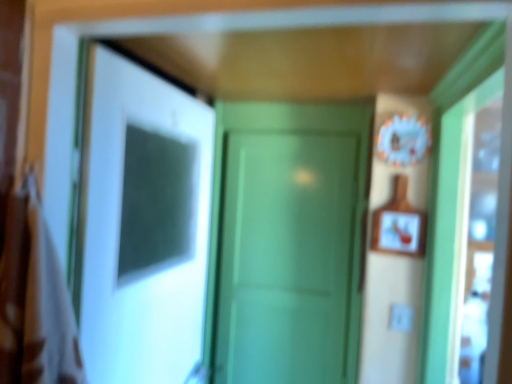
The width and height of the screenshot is (512, 384). What do you see at coordinates (398, 232) in the screenshot?
I see `wooden framed picture at right` at bounding box center [398, 232].

Image resolution: width=512 pixels, height=384 pixels. Describe the element at coordinates (34, 300) in the screenshot. I see `brown fabric laundry at left` at that location.

Find the location of a particular element. Image resolution: width=512 pixels, height=384 pixels. wooden framed picture at right is located at coordinates (398, 232).

Is point (229, 376) more distant than point (384, 221)?

Yes, it is.

Is green matte door at center, which appears as the second door when viewed from the left, directly adjacent to wooden framed picture at right?

No, green matte door at center, which appears as the second door when viewed from the left, is not making contact with wooden framed picture at right.

Do you think green matte door at center, which is counted as the first door, starting from the back, is within wooden framed picture at right, or outside of it?

green matte door at center, which is counted as the first door, starting from the back, is not inside wooden framed picture at right, it's outside.

From the image's perspective, which one is positioned lower, green matte door at center, which appears as the second door when viewed from the left, or wooden framed picture at right?

green matte door at center, which appears as the second door when viewed from the left.

Is point (170, 114) closer or farther from the camera than point (79, 354)?

Point (170, 114) appears to be farther away from the viewer than point (79, 354).

From a real-world perspective, is white glossy door at center, which ranks as the 2th door in back-to-front order, physically below brown fabric laundry at left?

No, from a real-world perspective, white glossy door at center, which ranks as the 2th door in back-to-front order, is not below brown fabric laundry at left.

The width and height of the screenshot is (512, 384). Identify the location of door that appears above the brown fabric laundry at left (from a real-world perspective). (144, 225).

Is white glossy door at center, which ranks as the 2th door in back-to-front order, facing away from brown fabric laundry at left?

white glossy door at center, which ranks as the 2th door in back-to-front order, is not turned away from brown fabric laundry at left.

Considering the sizes of brown fabric laundry at left and green matte door at center, arranged as the 1th door when viewed from the right, in the image, is brown fabric laundry at left taller or shorter than green matte door at center, arranged as the 1th door when viewed from the right,?

Clearly, brown fabric laundry at left is shorter compared to green matte door at center, arranged as the 1th door when viewed from the right.

Based on the photo, from the image's perspective, who appears lower, brown fabric laundry at left or green matte door at center, which is counted as the first door, starting from the back?

From the image's view, green matte door at center, which is counted as the first door, starting from the back, is below.

Is brown fabric laundry at left bigger than green matte door at center, acting as the second door starting from the front?

Actually, brown fabric laundry at left might be smaller than green matte door at center, acting as the second door starting from the front.

Is there a large distance between green matte door at center, acting as the second door starting from the front, and brown fabric laundry at left?

Indeed, green matte door at center, acting as the second door starting from the front, is not near brown fabric laundry at left.

Consider the image. Would you say green matte door at center, arranged as the 1th door when viewed from the right, is inside or outside brown fabric laundry at left?

The correct answer is: outside.

Does point (350, 263) come behind point (61, 316)?

Yes.

Is green matte door at center, arranged as the 1th door when viewed from the right, oriented towards brown fabric laundry at left?

Yes.

From a real-world perspective, which object rests below the other?

green matte door at center, which is counted as the first door, starting from the back, is physically lower.

In the image, is wooden framed picture at right on the left side or the right side of green matte door at center, arranged as the 1th door when viewed from the right?

Based on their positions, wooden framed picture at right is located to the right of green matte door at center, arranged as the 1th door when viewed from the right.

Measure the distance between wooden framed picture at right and green matte door at center, arranged as the 1th door when viewed from the right.

wooden framed picture at right is 17.00 inches away from green matte door at center, arranged as the 1th door when viewed from the right.

At what (x,y) coordinates should I click in order to perform the action: click on picture frame above the green matte door at center, which appears as the second door when viewed from the left (from a real-world perspective). Please return your answer as a coordinate pair (x, y). The width and height of the screenshot is (512, 384). Looking at the image, I should click on (398, 232).

Is white glossy door at center, the 1th door from the left, taller than green matte door at center, which appears as the second door when viewed from the left?

In fact, white glossy door at center, the 1th door from the left, may be shorter than green matte door at center, which appears as the second door when viewed from the left.

Based on the photo, is white glossy door at center, which ranks as the second door in right-to-left order, oriented away from green matte door at center, arranged as the 1th door when viewed from the right?

No, white glossy door at center, which ranks as the second door in right-to-left order, is not facing the opposite direction of green matte door at center, arranged as the 1th door when viewed from the right.

From a real-world perspective, who is located higher, white glossy door at center, which ranks as the 2th door in back-to-front order, or green matte door at center, which is counted as the first door, starting from the back?

white glossy door at center, which ranks as the 2th door in back-to-front order, is physically above.

Considering the sizes of objects white glossy door at center, which ranks as the 1th door in front-to-back order, and green matte door at center, which is counted as the first door, starting from the back, in the image provided, who is bigger, white glossy door at center, which ranks as the 1th door in front-to-back order, or green matte door at center, which is counted as the first door, starting from the back,?

With larger size is white glossy door at center, which ranks as the 1th door in front-to-back order.

In the image, is brown fabric laundry at left positioned in front of or behind wooden framed picture at right?

Clearly, brown fabric laundry at left is in front of wooden framed picture at right.

Can wooden framed picture at right be found inside brown fabric laundry at left?

Actually, wooden framed picture at right is outside brown fabric laundry at left.

Identify the location of picture frame above the brown fabric laundry at left (from a real-world perspective). The width and height of the screenshot is (512, 384). (398, 232).

From the picture: Which of these two, brown fabric laundry at left or wooden framed picture at right, is wider?

brown fabric laundry at left is wider.

Starting from the wooden framed picture at right, which door is the 1st one to the left? Please provide its 2D coordinates.

[(288, 241)]

Locate an element on the screen. This screenshot has width=512, height=384. laundry that appears below the white glossy door at center, the 1th door from the left (from a real-world perspective) is located at coordinates (34, 300).

Estimate the real-world distances between objects in this image. Which object is further from wooden framed picture at right, white glossy door at center, which ranks as the 1th door in front-to-back order, or green matte door at center, which appears as the second door when viewed from the left?

The object further to wooden framed picture at right is white glossy door at center, which ranks as the 1th door in front-to-back order.

Considering their positions, is green matte door at center, acting as the second door starting from the front, positioned further to white glossy door at center, which ranks as the second door in right-to-left order, than brown fabric laundry at left?

green matte door at center, acting as the second door starting from the front, is positioned further to the anchor white glossy door at center, which ranks as the second door in right-to-left order.

From the image, which object appears to be farther from brown fabric laundry at left, white glossy door at center, which ranks as the 1th door in front-to-back order, or wooden framed picture at right?

wooden framed picture at right is positioned further to the anchor brown fabric laundry at left.

Estimate the real-world distances between objects in this image. Which object is further from wooden framed picture at right, brown fabric laundry at left or white glossy door at center, the 1th door from the left?

brown fabric laundry at left is positioned further to the anchor wooden framed picture at right.

When comparing their distances from wooden framed picture at right, does brown fabric laundry at left or green matte door at center, acting as the second door starting from the front, seem further?

Based on the image, brown fabric laundry at left appears to be further to wooden framed picture at right.

Estimate the real-world distances between objects in this image. Which object is closer to white glossy door at center, the 1th door from the left, wooden framed picture at right or green matte door at center, which is counted as the first door, starting from the back?

green matte door at center, which is counted as the first door, starting from the back, is closer to white glossy door at center, the 1th door from the left.

Looking at the image, which one is located closer to green matte door at center, which is counted as the first door, starting from the back, white glossy door at center, which ranks as the second door in right-to-left order, or wooden framed picture at right?

wooden framed picture at right is closer to green matte door at center, which is counted as the first door, starting from the back.

When comparing their distances from green matte door at center, which is counted as the first door, starting from the back, does brown fabric laundry at left or wooden framed picture at right seem further?

Among the two, brown fabric laundry at left is located further to green matte door at center, which is counted as the first door, starting from the back.

Where is `door located between brown fabric laundry at left and green matte door at center, which is counted as the first door, starting from the back, in the depth direction`? This screenshot has height=384, width=512. door located between brown fabric laundry at left and green matte door at center, which is counted as the first door, starting from the back, in the depth direction is located at coordinates (x=144, y=225).

Locate an element on the screen. The width and height of the screenshot is (512, 384). picture frame between brown fabric laundry at left and green matte door at center, which appears as the second door when viewed from the left, in the front-back direction is located at coordinates (398, 232).

Image resolution: width=512 pixels, height=384 pixels. Find the location of `picture frame positioned between white glossy door at center, which ranks as the 2th door in back-to-front order, and green matte door at center, which appears as the second door when viewed from the left, from near to far`. picture frame positioned between white glossy door at center, which ranks as the 2th door in back-to-front order, and green matte door at center, which appears as the second door when viewed from the left, from near to far is located at coordinates (398, 232).